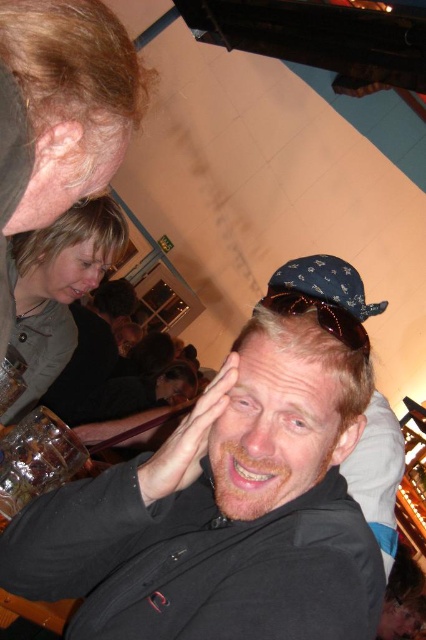
Question: Can you confirm if smooth skin at center is bigger than matte black hair at center?

Choices:
 (A) yes
 (B) no

Answer: (B)

Question: Which point is closer to the camera?

Choices:
 (A) (78, 234)
 (B) (169, 360)
 (C) (402, 602)
 (D) (120, 326)

Answer: (A)

Question: Which object is the farthest from the brown fur head at center?

Choices:
 (A) blonde hair at center
 (B) matte black head at center
 (C) matte black hair at center

Answer: (A)

Question: Considering the relative positions of matte black shirt at center and light brown hair at upper left in the image provided, where is matte black shirt at center located with respect to light brown hair at upper left?

Choices:
 (A) below
 (B) above

Answer: (A)

Question: Is blonde hair at center further to the viewer compared to brown fur head at center?

Choices:
 (A) yes
 (B) no

Answer: (B)

Question: Among these objects, which one is nearest to the camera?

Choices:
 (A) matte black hair at upper left
 (B) light brown skin at upper center

Answer: (B)